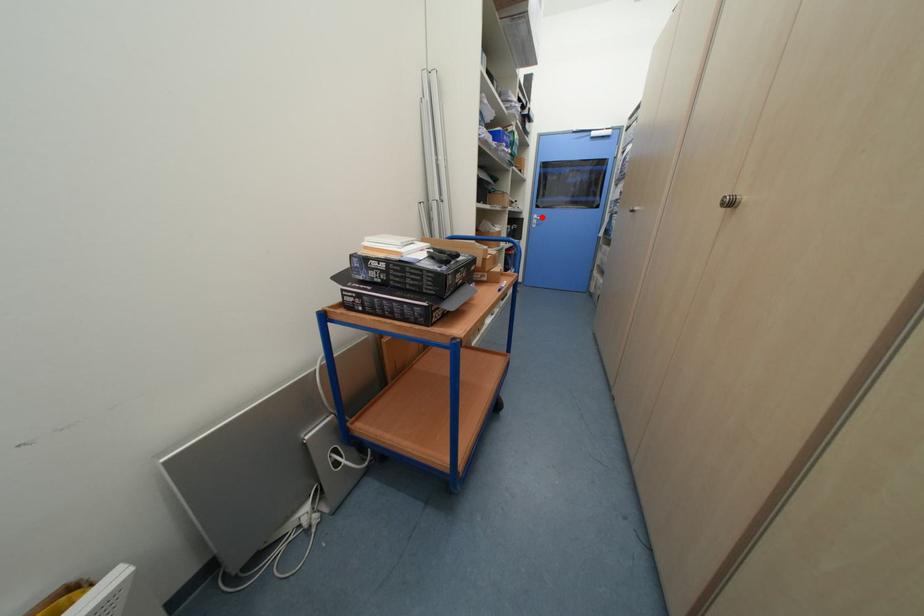
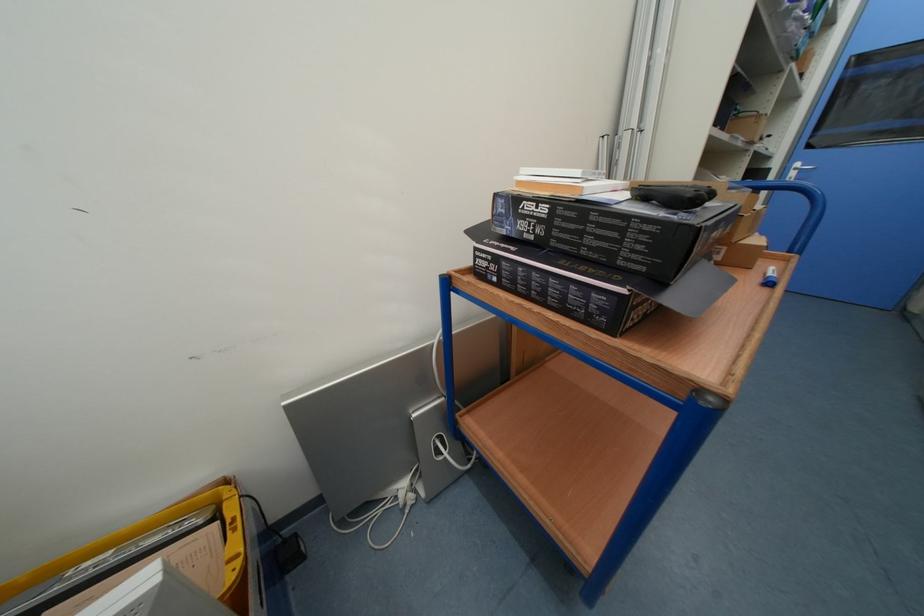
Find the pixel in the second image that matches the highlighted location in the first image.

(804, 166)